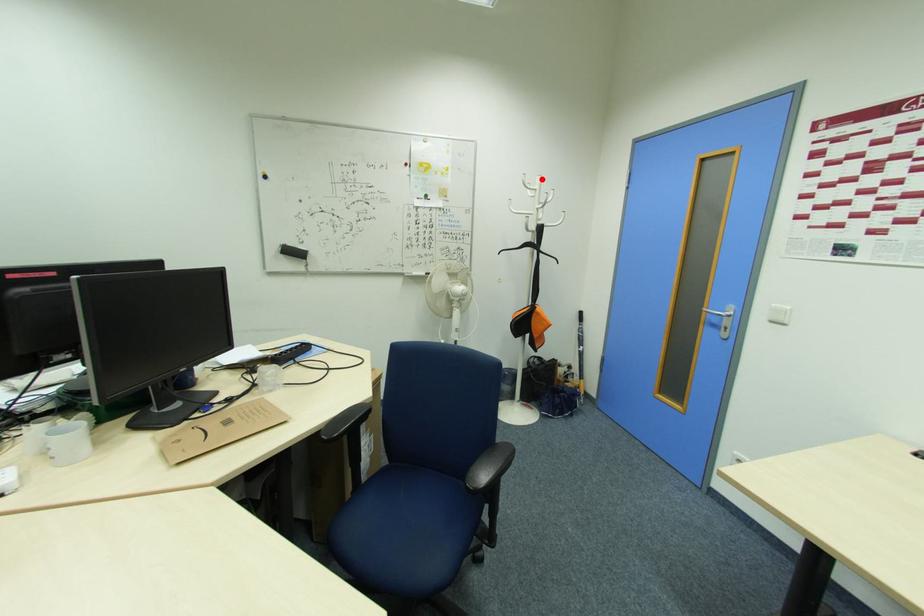
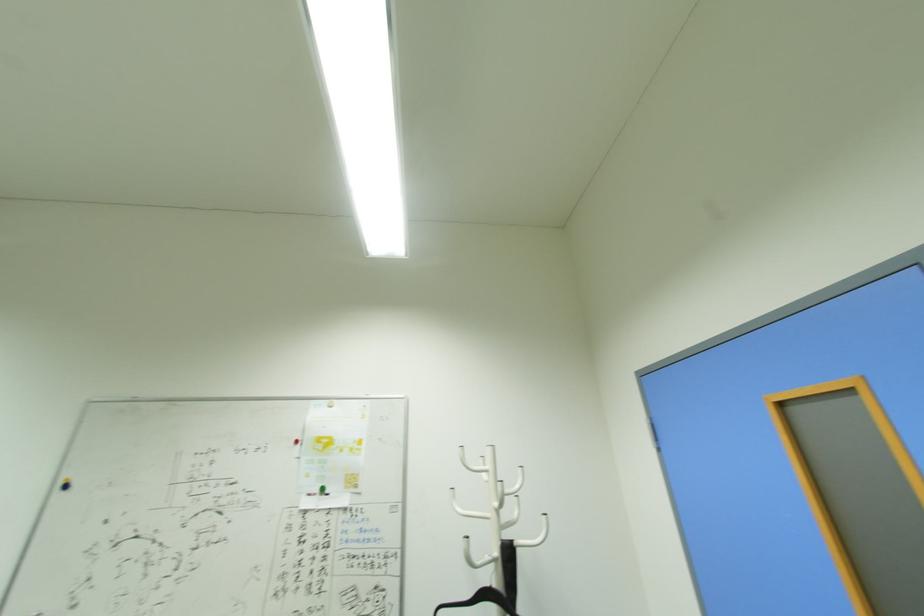
Where in the second image is the point corresponding to the highlighted location from the first image?

(493, 451)